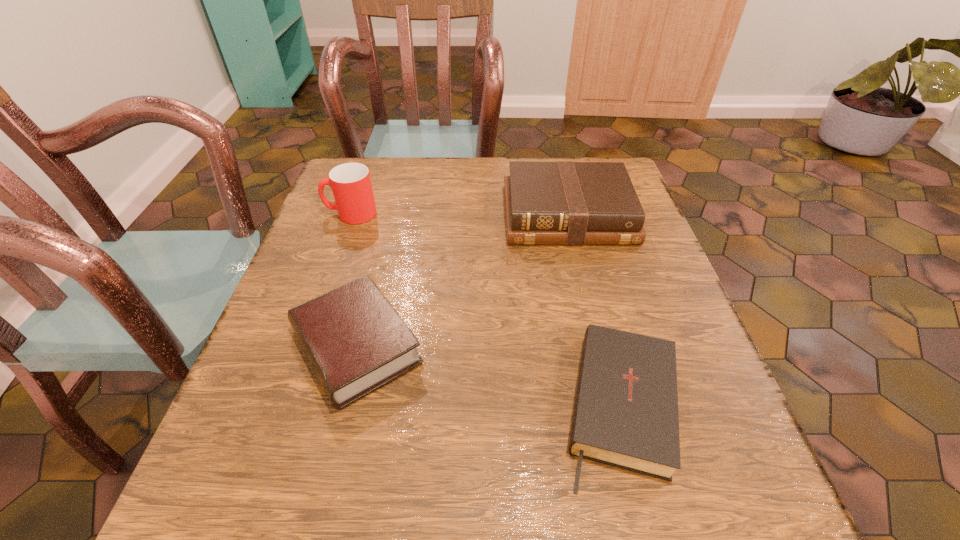
At what (x,y) coordinates should I click in order to perform the action: click on unoccupied position between the shortest Bible and the tallest Bible. Please return your answer as a coordinate pair (x, y). This screenshot has height=540, width=960. Looking at the image, I should click on (595, 311).

At what (x,y) coordinates should I click in order to perform the action: click on free spot between the tallest object and the second shortest object. Please return your answer as a coordinate pair (x, y). Looking at the image, I should click on (353, 280).

Identify the location of free point between the leftmost Bible and the tallest Bible. (462, 281).

I want to click on unoccupied area between the shortest object and the tallest object, so click(x=487, y=310).

The image size is (960, 540). What are the coordinates of `the third closest object relative to the tallest Bible` in the screenshot? It's located at (350, 182).

Identify which object is the third nearest to the shortest object. Please provide its 2D coordinates. Your answer should be formatted as a tuple, i.e. [(x, y)], where the tuple contains the x and y coordinates of a point satisfying the conditions above.

[(350, 182)]

Image resolution: width=960 pixels, height=540 pixels. I want to click on Bible that stands as the closest to the shortest Bible, so click(x=356, y=342).

Identify the location of the second closest Bible relative to the second tallest object. (625, 415).

Image resolution: width=960 pixels, height=540 pixels. Identify the location of free space that satisfies the following two spatial constraints: 1. on the spine side of the shortest Bible; 2. on the left side of the farthest Bible. (613, 407).

Image resolution: width=960 pixels, height=540 pixels. Identify the location of vacant region that satisfies the following two spatial constraints: 1. on the spine side of the shortest object; 2. on the left side of the tallest Bible. (613, 407).